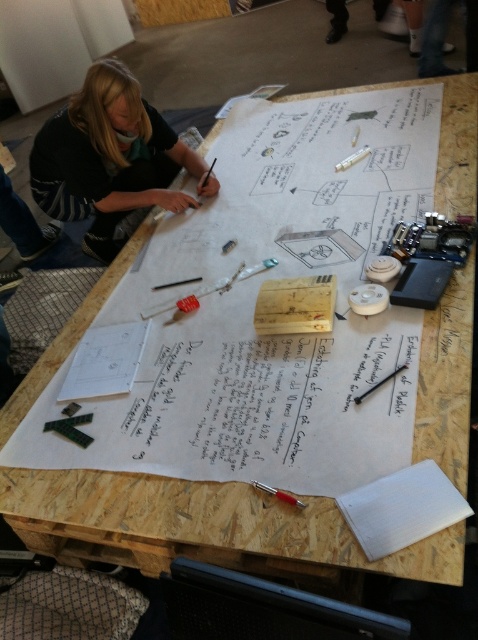
Who is more forward, (400, 497) or (282, 499)?

Point (400, 497) is in front.

Is point (369, 497) in front of point (261, 490)?

Yes.

At what (x,y) coordinates should I click in order to perform the action: click on white paper at lower right. Please return your answer as a coordinate pair (x, y). This screenshot has width=478, height=640. Looking at the image, I should click on (401, 508).

Who is positioned more to the left, blonde hair at upper left or metallic red pen at lower center?

blonde hair at upper left

Can you confirm if blonde hair at upper left is positioned to the right of metallic red pen at lower center?

In fact, blonde hair at upper left is to the left of metallic red pen at lower center.

Is point (119, 76) positioned before point (260, 490)?

That is False.

I want to click on blonde hair at upper left, so click(109, 157).

The width and height of the screenshot is (478, 640). Describe the element at coordinates (109, 157) in the screenshot. I see `blonde hair at upper left` at that location.

Measure the distance between blonde hair at upper left and white paper at lower right.

They are 1.47 meters apart.

Is point (85, 246) less distant than point (416, 525)?

No, (85, 246) is further to viewer.

Where is `blonde hair at upper left`? blonde hair at upper left is located at coordinates (109, 157).